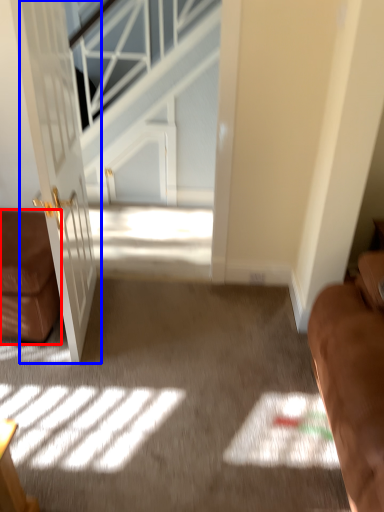
Question: Which point is closer to the camera, furniture (highlighted by a red box) or door (highlighted by a blue box)?

Choices:
 (A) furniture
 (B) door

Answer: (B)